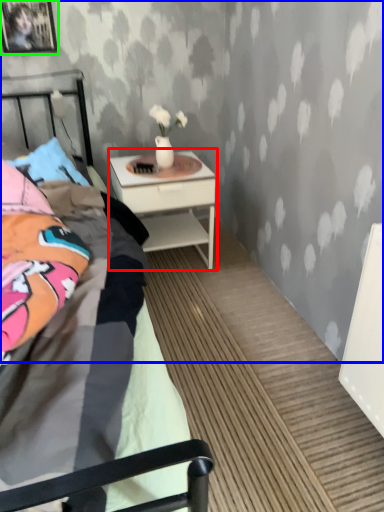
Question: Which is farther away from nightstand (highlighted by a red box)? backdrop (highlighted by a blue box) or picture frame (highlighted by a green box)?

Choices:
 (A) backdrop
 (B) picture frame

Answer: (B)